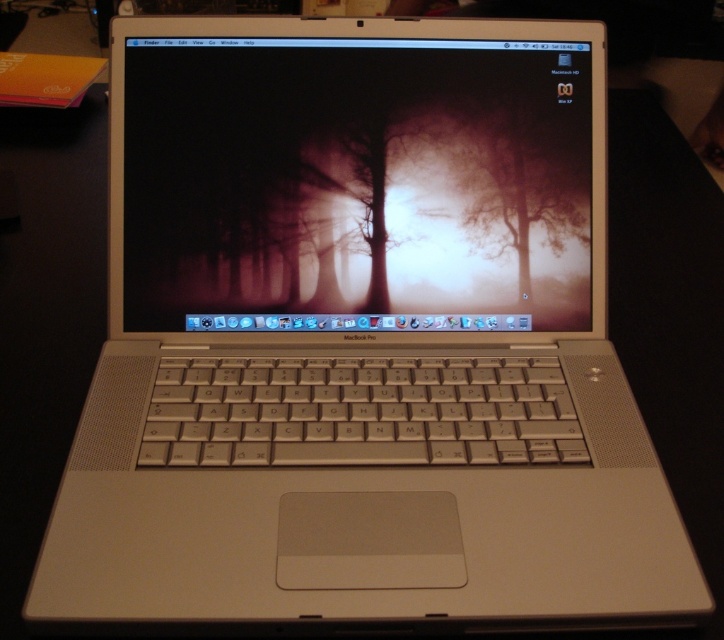
Question: Can you confirm if satin silver laptop at center is positioned to the left of translucent foggy tree at center?

Choices:
 (A) no
 (B) yes

Answer: (B)

Question: Can you confirm if satin silver laptop at center is positioned below translucent foggy tree at center?

Choices:
 (A) no
 (B) yes

Answer: (A)

Question: Is satin silver laptop at center further to camera compared to translucent foggy tree at center?

Choices:
 (A) yes
 (B) no

Answer: (B)

Question: Which point is closer to the camera?

Choices:
 (A) translucent foggy tree at center
 (B) satin silver laptop at center

Answer: (B)

Question: Which object is farther from the camera taking this photo?

Choices:
 (A) translucent foggy tree at center
 (B) satin silver laptop at center

Answer: (A)